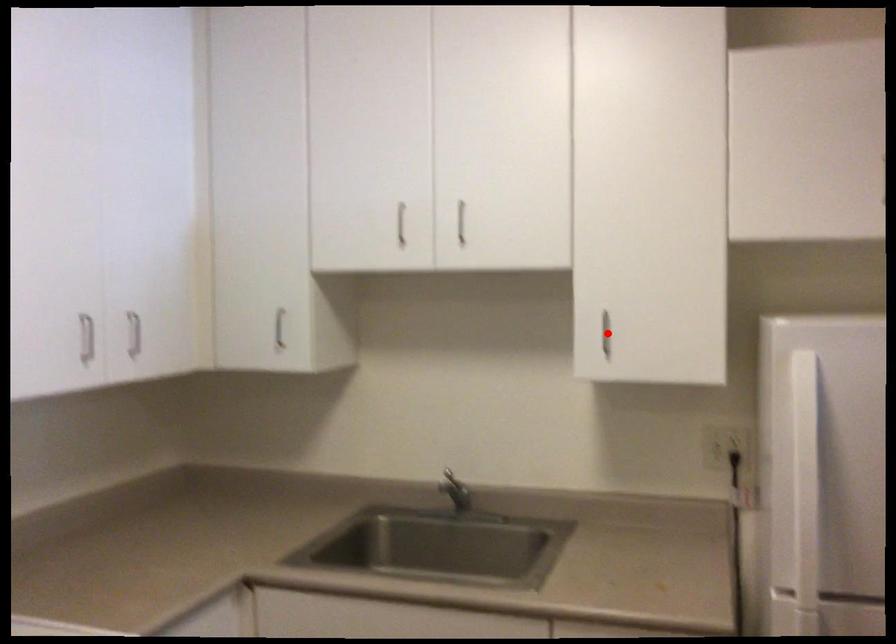
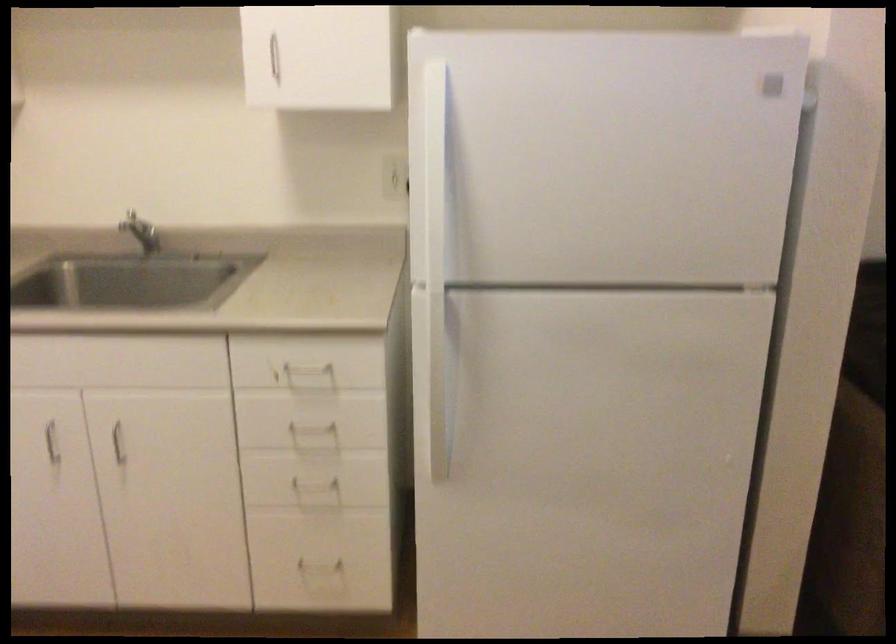
In the second image, find the point that corresponds to the highlighted location in the first image.

(270, 59)